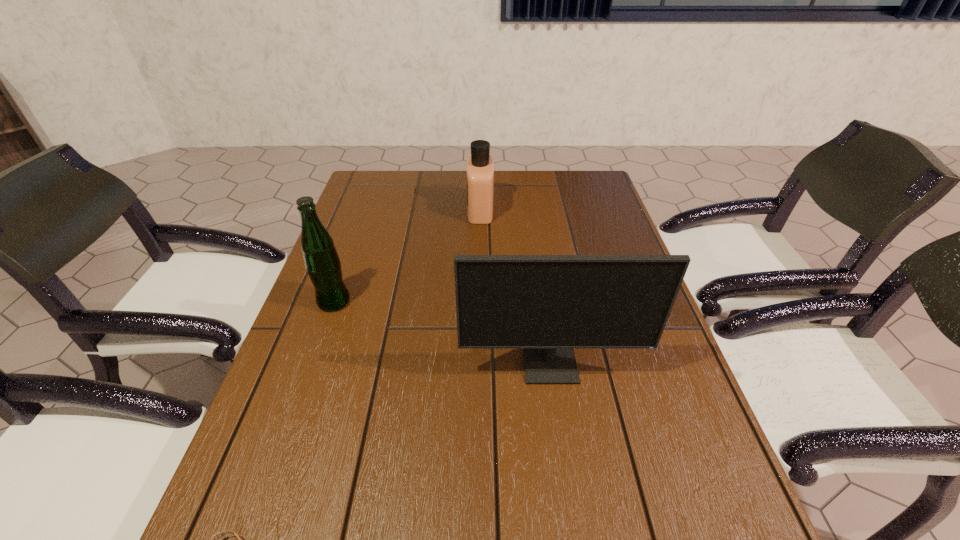
This screenshot has width=960, height=540. What are the coordinates of `the second nearest object` in the screenshot? It's located at (548, 305).

Locate an element on the screen. This screenshot has height=540, width=960. beer bottle is located at coordinates (322, 262).

Locate an element on the screen. The height and width of the screenshot is (540, 960). the second shortest object is located at coordinates (x=480, y=168).

Locate an element on the screen. Image resolution: width=960 pixels, height=540 pixels. perfume is located at coordinates (480, 168).

The width and height of the screenshot is (960, 540). I want to click on vacant space located 0.260m on the front-facing side of the second nearest object, so click(573, 520).

Identify the location of vacant area situated 0.070m on the right of the beer bottle. [378, 302].

Where is `blank space located 0.200m on the front label of the perfume`? blank space located 0.200m on the front label of the perfume is located at coordinates [x=405, y=210].

In order to click on blank space located 0.250m on the front label of the perfume in this screenshot , I will do `click(389, 210)`.

Identify the location of free space located on the front label of the perfume. The image size is (960, 540). (396, 210).

Where is `object that is at the far edge`? The image size is (960, 540). object that is at the far edge is located at coordinates (480, 168).